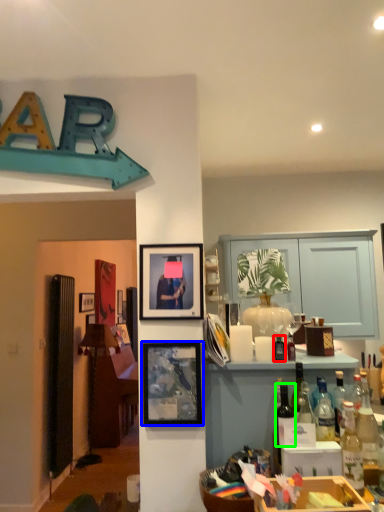
Question: Estimate the real-world distances between objects in this image. Which object is closer to bottle (highlighted by a red box), picture frame (highlighted by a blue box) or bottle (highlighted by a green box)?

Choices:
 (A) picture frame
 (B) bottle

Answer: (B)